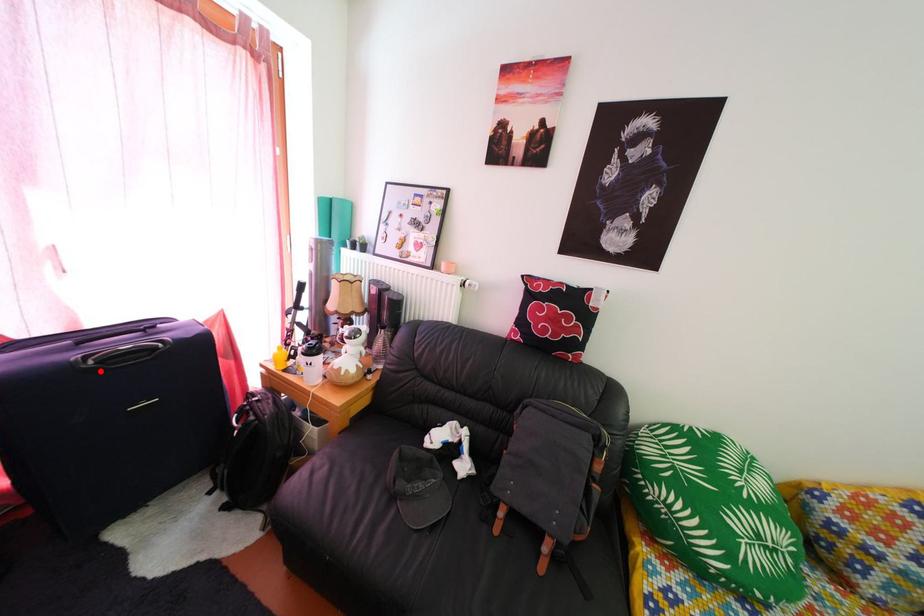
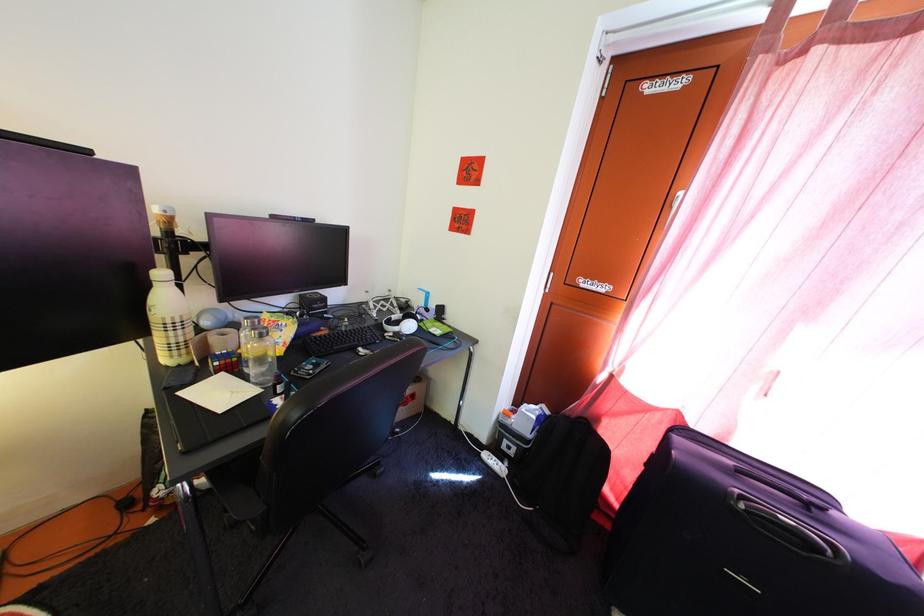
Question: I am providing you with two images of the same scene from different viewpoints. Image1 has a red point marked. In image2, the corresponding 3D location appears at what relative position? Reply with the corresponding letter.

Choices:
 (A) Closer
 (B) Farther

Answer: (B)